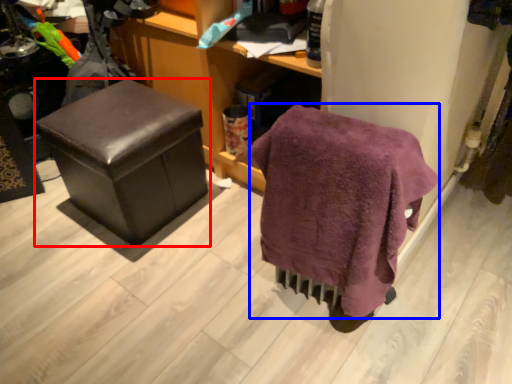
Question: Which object is further to the camera taking this photo, furniture (highlighted by a red box) or bath towel (highlighted by a blue box)?

Choices:
 (A) furniture
 (B) bath towel

Answer: (A)